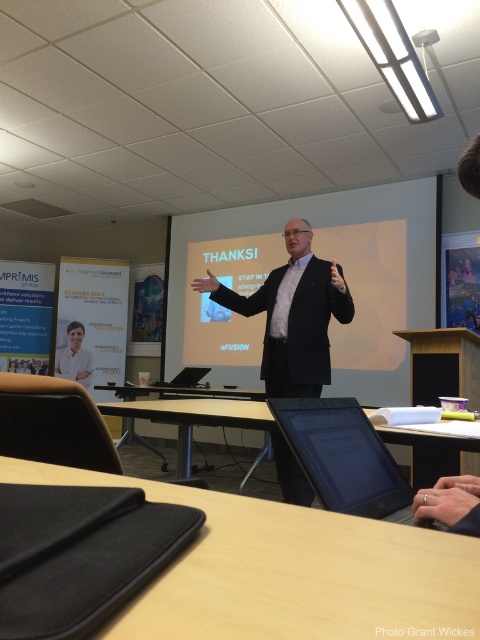
Looking at this image, you are organizing a workshop and need to place a large whiteboard between the wooden table at center and the white matte projection screen at center. Which object should the whiteboard be placed closer to if the screen is larger?

The whiteboard should be placed closer to the wooden table at center because it has a smaller size compared to the white matte projection screen at center, so there might be more space available near the table to accommodate the whiteboard without blocking the screen.

You are standing in the conference room and want to take a photo of the point at coordinates (301, 566). The camera you have can only focus on objects within 12 inches. Will the point be in focus?

The point at coordinates (301, 566) is 15.46 inches away from the camera, which is beyond the camera focus range of 12 inches. Therefore, the point will not be in focus.